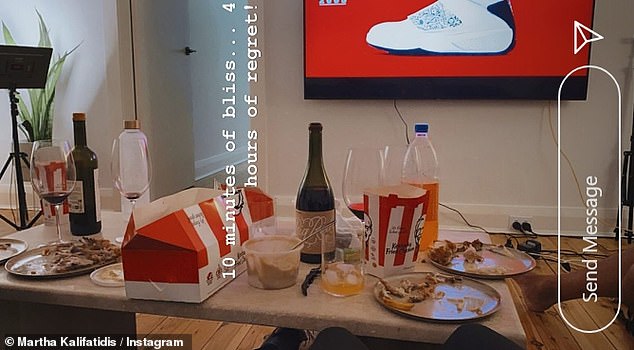
Image resolution: width=634 pixels, height=350 pixels. I want to click on table, so click(x=287, y=311).